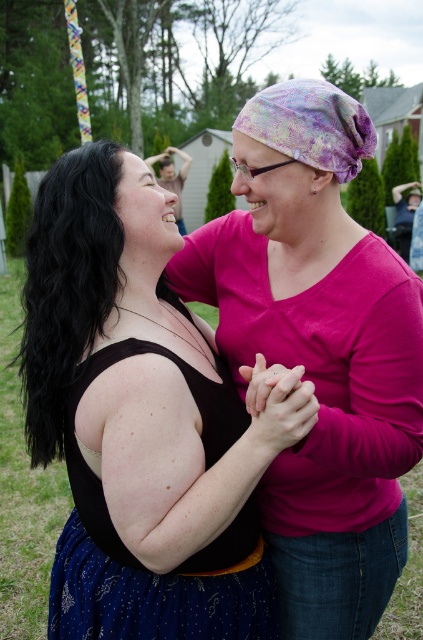
Who is more forward, (x=320, y=314) or (x=354, y=120)?

Point (x=354, y=120)

Can you confirm if pink fabric shirt at center is positioned to the left of pastel tie-dye fabric headscarf at center?

Yes, pink fabric shirt at center is to the left of pastel tie-dye fabric headscarf at center.

Which is behind, point (403, 300) or point (337, 172)?

Positioned behind is point (337, 172).

Locate an element on the screen. This screenshot has height=640, width=423. pink fabric shirt at center is located at coordinates (318, 352).

Between matte pink shirt at center and pink fabric shirt at center, which one appears on the left side from the viewer's perspective?

From the viewer's perspective, matte pink shirt at center appears more on the left side.

Find the location of a particular element. The image size is (423, 640). matte pink shirt at center is located at coordinates (142, 420).

You are a GUI agent. You are given a task and a screenshot of the screen. Output one action in this format:
    pyautogui.click(x=<x>, y=<y>)
    Task: Click on the matte pink shirt at center
    
    Given the screenshot: What is the action you would take?
    pyautogui.click(x=142, y=420)

Is matte pink shirt at center above pastel tie-dye fabric headscarf at center?

No.

Is point (235, 616) farther from viewer compared to point (343, 176)?

No, (235, 616) is closer to viewer.

Is point (77, 252) more distant than point (247, 112)?

No, it is not.

Where is `matte pink shirt at center`? This screenshot has width=423, height=640. matte pink shirt at center is located at coordinates (142, 420).